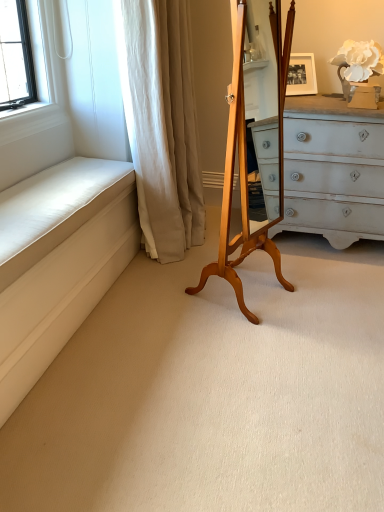
Question: Does white matte flower at upper right lie behind white fabric curtain at left?

Choices:
 (A) no
 (B) yes

Answer: (B)

Question: Are white matte flower at upper right and white fabric curtain at left located far from each other?

Choices:
 (A) yes
 (B) no

Answer: (A)

Question: Is the position of white matte flower at upper right less distant than that of white fabric curtain at left?

Choices:
 (A) no
 (B) yes

Answer: (A)

Question: Considering the relative positions of white matte flower at upper right and white fabric curtain at left in the image provided, is white matte flower at upper right to the right of white fabric curtain at left from the viewer's perspective?

Choices:
 (A) yes
 (B) no

Answer: (A)

Question: Could you tell me if white matte flower at upper right is facing white fabric curtain at left?

Choices:
 (A) no
 (B) yes

Answer: (A)

Question: Is white matte flower at upper right smaller than white fabric curtain at left?

Choices:
 (A) no
 (B) yes

Answer: (B)

Question: Can you confirm if white fabric curtain at left is bigger than light brown wood easel at center?

Choices:
 (A) no
 (B) yes

Answer: (B)

Question: Is white fabric curtain at left turned away from light brown wood easel at center?

Choices:
 (A) yes
 (B) no

Answer: (B)

Question: Does white fabric curtain at left lie in front of light brown wood easel at center?

Choices:
 (A) no
 (B) yes

Answer: (A)

Question: From the image's perspective, does white fabric curtain at left appear higher than light brown wood easel at center?

Choices:
 (A) yes
 (B) no

Answer: (A)

Question: Is white fabric curtain at left wider than light brown wood easel at center?

Choices:
 (A) yes
 (B) no

Answer: (A)

Question: Considering the relative sizes of white fabric curtain at left and light brown wood easel at center in the image provided, is white fabric curtain at left taller than light brown wood easel at center?

Choices:
 (A) yes
 (B) no

Answer: (A)

Question: Can you confirm if light brown wood easel at center is smaller than white matte flower at upper right?

Choices:
 (A) no
 (B) yes

Answer: (A)